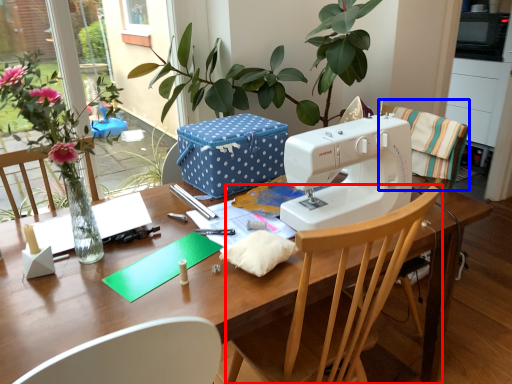
Question: Among these objects, which one is farthest to the camera, chair (highlighted by a red box) or chair (highlighted by a blue box)?

Choices:
 (A) chair
 (B) chair

Answer: (B)